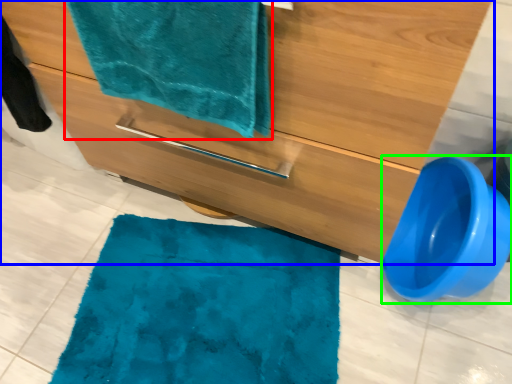
Question: Which is nearer to the towel (highlighted by a red box)? bathroom cabinet (highlighted by a blue box) or toilet bowl (highlighted by a green box).

Choices:
 (A) bathroom cabinet
 (B) toilet bowl

Answer: (A)